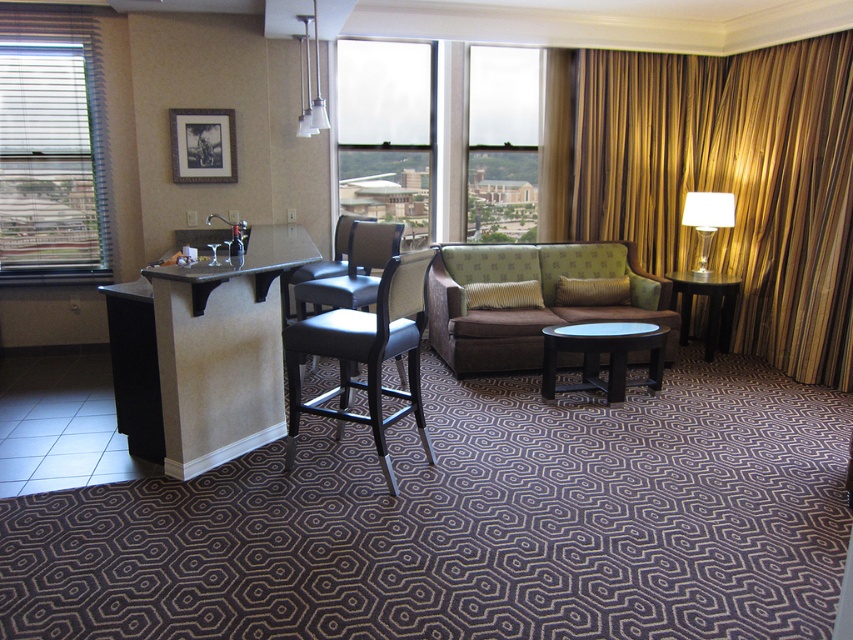
Does black wood side table at right have a greater height compared to white glass lamp at right?

Correct, black wood side table at right is much taller as white glass lamp at right.

Does point (715, 332) come behind point (723, 196)?

That is True.

Is point (714, 340) more distant than point (712, 232)?

No, it is in front of (712, 232).

Find the location of a particular element. Image resolution: width=853 pixels, height=640 pixels. black wood side table at right is located at coordinates (708, 305).

Where is `transparent glass window at upper center`? This screenshot has height=640, width=853. transparent glass window at upper center is located at coordinates (386, 129).

Who is higher up, transparent glass window at upper center or blue glass table at center?

Positioned higher is transparent glass window at upper center.

Where is `transparent glass window at upper center`? This screenshot has width=853, height=640. transparent glass window at upper center is located at coordinates (386, 129).

Is transparent glass windows at center taller than transparent glass window at upper center?

Correct, transparent glass windows at center is much taller as transparent glass window at upper center.

The height and width of the screenshot is (640, 853). I want to click on transparent glass windows at center, so click(x=448, y=134).